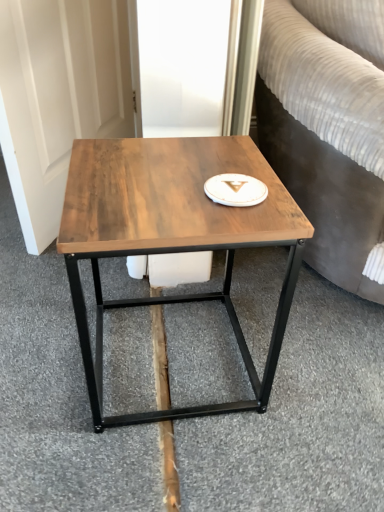
Where is `white glossy platter at center`? The image size is (384, 512). white glossy platter at center is located at coordinates (235, 190).

Where is `brown wood plank at center`? The height and width of the screenshot is (512, 384). brown wood plank at center is located at coordinates (160, 359).

Is the depth of wooden table at center less than that of white glossy platter at center?

Yes.

Is wooden table at center next to white glossy platter at center and touching it?

No.

From the image's perspective, is wooden table at center over white glossy platter at center?

No, from the image's perspective, wooden table at center is not above white glossy platter at center.

From the picture: Is wooden table at center spatially inside white glossy platter at center, or outside of it?

wooden table at center cannot be found inside white glossy platter at center.

Could you tell me if brown wood plank at center is facing white glossy platter at center?

No, brown wood plank at center does not turn towards white glossy platter at center.

From a real-world perspective, between brown wood plank at center and white glossy platter at center, who is vertically lower?

In real-world perspective, brown wood plank at center is lower.

In the scene shown: Can you tell me how much brown wood plank at center and white glossy platter at center differ in facing direction?

2.08 degrees.

You are a GUI agent. You are given a task and a screenshot of the screen. Output one action in this format:
    pyautogui.click(x=<x>, y=<y>)
    Task: Click on the plank below the white glossy platter at center (from the image's perspective)
    The width and height of the screenshot is (384, 512).
    Given the screenshot: What is the action you would take?
    pyautogui.click(x=160, y=359)

Which of these two, white glossy platter at center or wooden table at center, is bigger?

With larger size is wooden table at center.

Between white glossy platter at center and wooden table at center, which one is positioned behind?

white glossy platter at center.

Considering the relative sizes of white glossy platter at center and wooden table at center in the image provided, is white glossy platter at center wider than wooden table at center?

No, white glossy platter at center is not wider than wooden table at center.

Do you think brown wood plank at center is within wooden table at center, or outside of it?

brown wood plank at center lies outside wooden table at center.

The height and width of the screenshot is (512, 384). In order to click on plank directly beneath the wooden table at center (from a real-world perspective) in this screenshot , I will do `click(160, 359)`.

Is wooden table at center at the back of brown wood plank at center?

No, brown wood plank at center is not facing the opposite direction of wooden table at center.

Between white glossy platter at center and brown wood plank at center, which one appears on the right side from the viewer's perspective?

white glossy platter at center.

Who is taller, white glossy platter at center or brown wood plank at center?

brown wood plank at center is taller.

Which of these two, white glossy platter at center or brown wood plank at center, is bigger?

With larger size is brown wood plank at center.

Between wooden table at center and brown wood plank at center, which one has less height?

Standing shorter between the two is brown wood plank at center.

What's the angular difference between wooden table at center and brown wood plank at center's facing directions?

There is a 2.08-degree angle between the facing directions of wooden table at center and brown wood plank at center.

Looking at this image, is wooden table at center facing towards brown wood plank at center?

No, wooden table at center does not turn towards brown wood plank at center.

From the image's perspective, which is above, wooden table at center or brown wood plank at center?

From the image's view, wooden table at center is above.

The width and height of the screenshot is (384, 512). There is a wooden table at center. In order to click on platter above it (from a real-world perspective) in this screenshot , I will do `click(235, 190)`.

Find the location of `platter in front of the brown wood plank at center`. platter in front of the brown wood plank at center is located at coordinates (235, 190).

Considering their positions, is white glossy platter at center positioned closer to brown wood plank at center than wooden table at center?

The object closer to brown wood plank at center is wooden table at center.

When comparing their distances from brown wood plank at center, does wooden table at center or white glossy platter at center seem further?

white glossy platter at center lies further to brown wood plank at center than the other object.

Which object lies further to the anchor point white glossy platter at center, brown wood plank at center or wooden table at center?

brown wood plank at center is positioned further to the anchor white glossy platter at center.

Considering their positions, is brown wood plank at center positioned further to wooden table at center than white glossy platter at center?

brown wood plank at center.

Which object lies nearer to the anchor point white glossy platter at center, wooden table at center or brown wood plank at center?

wooden table at center lies closer to white glossy platter at center than the other object.

Which object lies further to the anchor point wooden table at center, white glossy platter at center or brown wood plank at center?

The object further to wooden table at center is brown wood plank at center.

What are the coordinates of `coffee table between white glossy platter at center and brown wood plank at center in the up-down direction` in the screenshot? It's located at (171, 238).